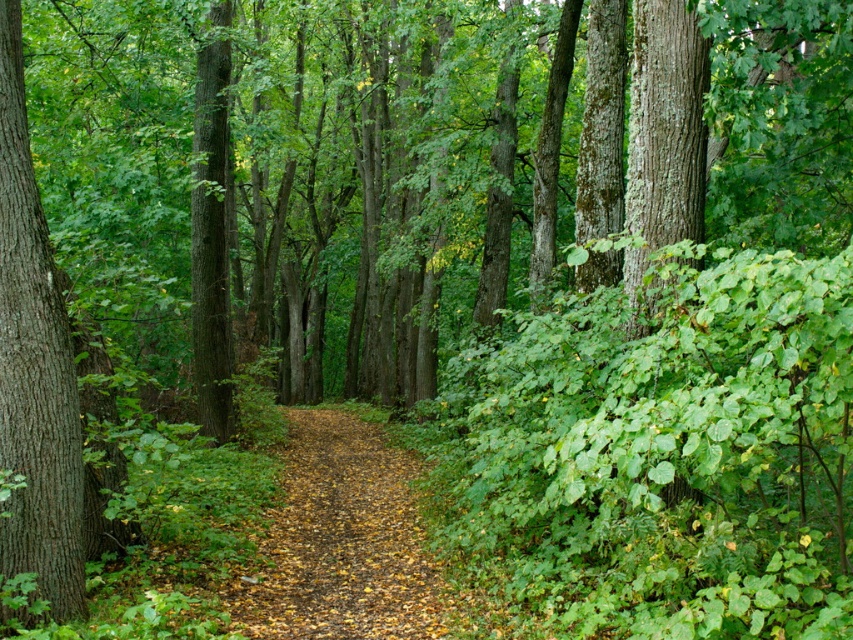
Can you confirm if yellow leafy path at center is positioned to the right of brown rough bark tree at left?

Indeed, yellow leafy path at center is positioned on the right side of brown rough bark tree at left.

Does yellow leafy path at center have a lesser width compared to brown rough bark tree at left?

No, yellow leafy path at center is not thinner than brown rough bark tree at left.

Find the location of a particular element. This screenshot has height=640, width=853. yellow leafy path at center is located at coordinates (343, 541).